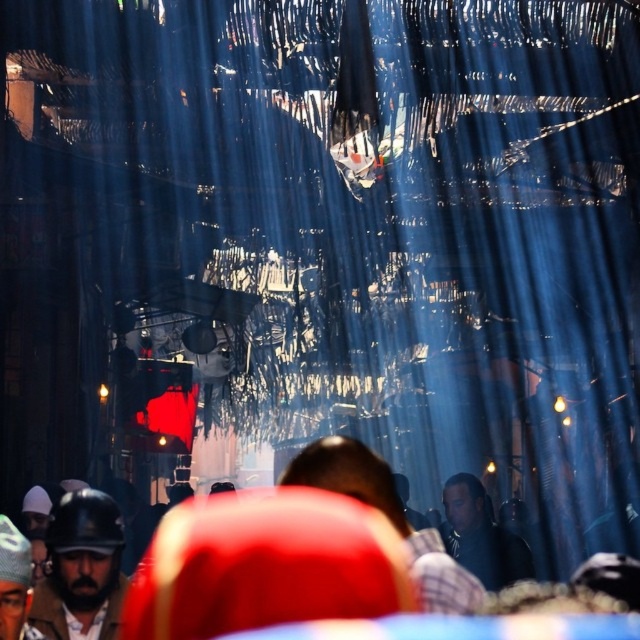
Is red fabric headscarf at center below matte black helmet at lower left?

Correct, red fabric headscarf at center is located below matte black helmet at lower left.

Who is lower down, red fabric headscarf at center or matte black helmet at lower left?

red fabric headscarf at center

You are a GUI agent. You are given a task and a screenshot of the screen. Output one action in this format:
    pyautogui.click(x=<x>, y=<y>)
    Task: Click on the red fabric headscarf at center
    
    Given the screenshot: What is the action you would take?
    pyautogui.click(x=276, y=550)

Measure the distance between matte black helmet at lower left and camera.

matte black helmet at lower left is 82.59 meters from camera.

Image resolution: width=640 pixels, height=640 pixels. In order to click on matte black helmet at lower left in this screenshot , I will do [x=81, y=570].

Who is more forward, (92, 531) or (524, 541)?

Point (92, 531) is in front.

Identify the location of matte black helmet at lower left. This screenshot has height=640, width=640. (81, 570).

Can you confirm if red fabric headscarf at center is positioned to the left of dark blue shirt at center?

Indeed, red fabric headscarf at center is positioned on the left side of dark blue shirt at center.

Is point (204, 564) positioned behind point (449, 554)?

No, (204, 564) is in front of (449, 554).

This screenshot has width=640, height=640. In order to click on red fabric headscarf at center in this screenshot , I will do `click(276, 550)`.